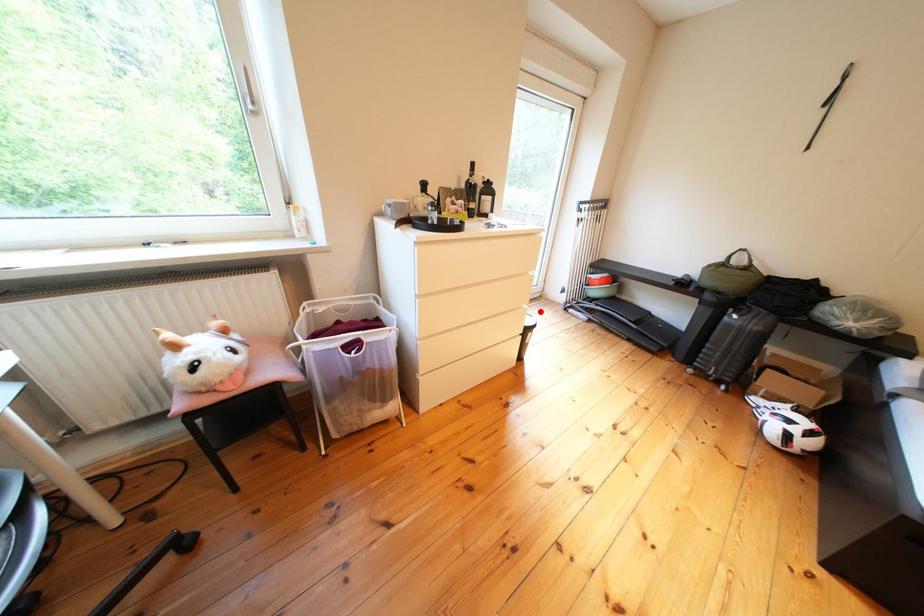
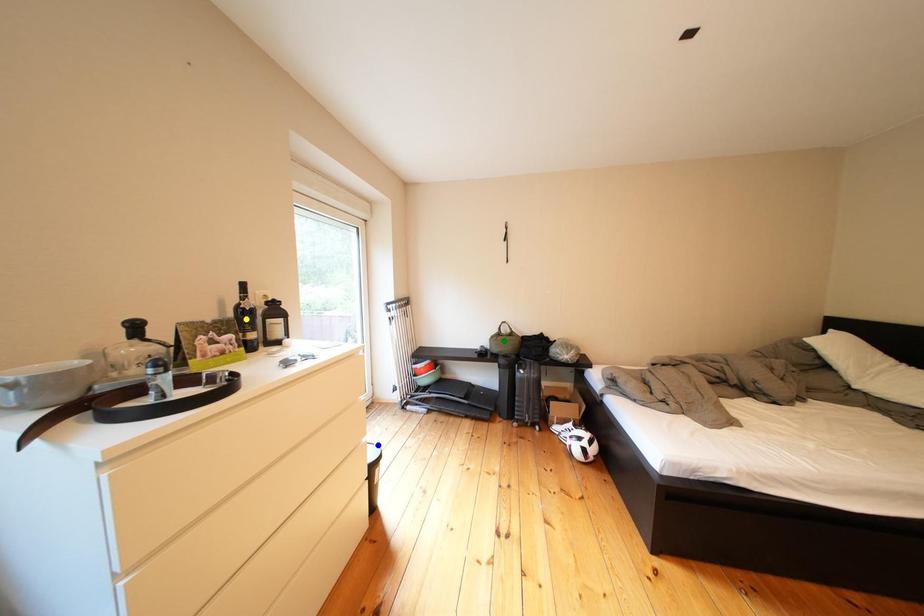
Question: I am providing you with two images of the same scene from different viewpoints. A red point is marked on the first image. You are given multiple points on the second image. Which point in image 2 is actually the same real-world point as the red point in image 1?

Choices:
 (A) green point
 (B) blue point
 (C) yellow point

Answer: (B)